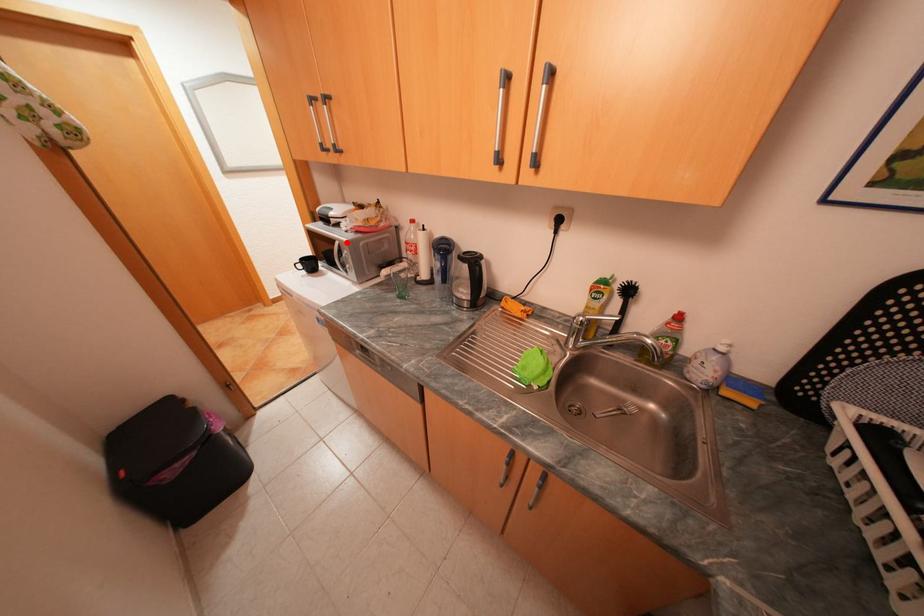
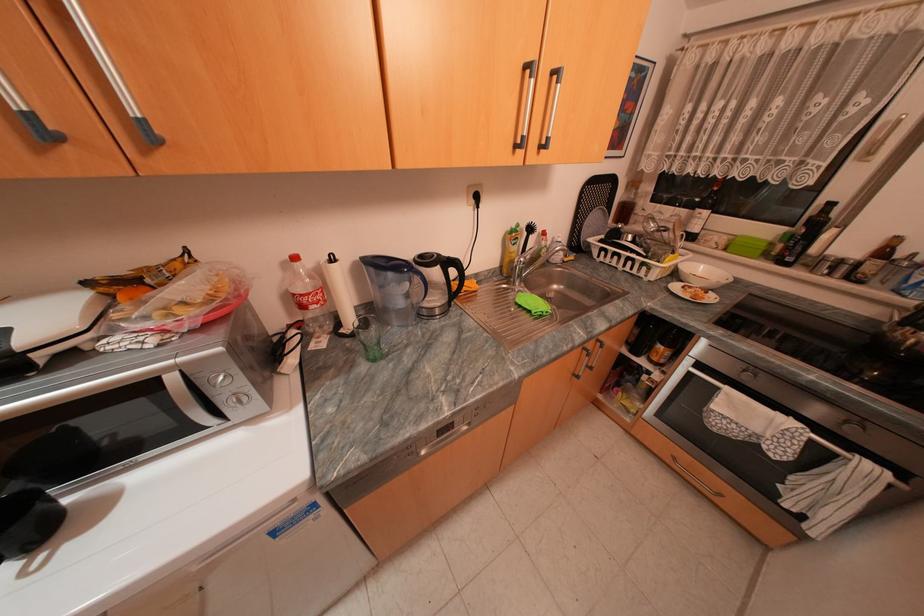
Question: A red point is marked in image1. In image2, is the corresponding 3D point closer to the camera or farther? Reply with the corresponding letter.

Choices:
 (A) The corresponding 3D point is closer.
 (B) The corresponding 3D point is farther.

Answer: (B)